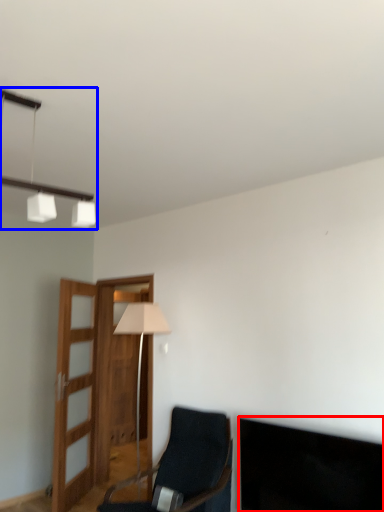
Question: Which point is further to the camera, dark (highlighted by a red box) or lamp (highlighted by a blue box)?

Choices:
 (A) dark
 (B) lamp

Answer: (A)